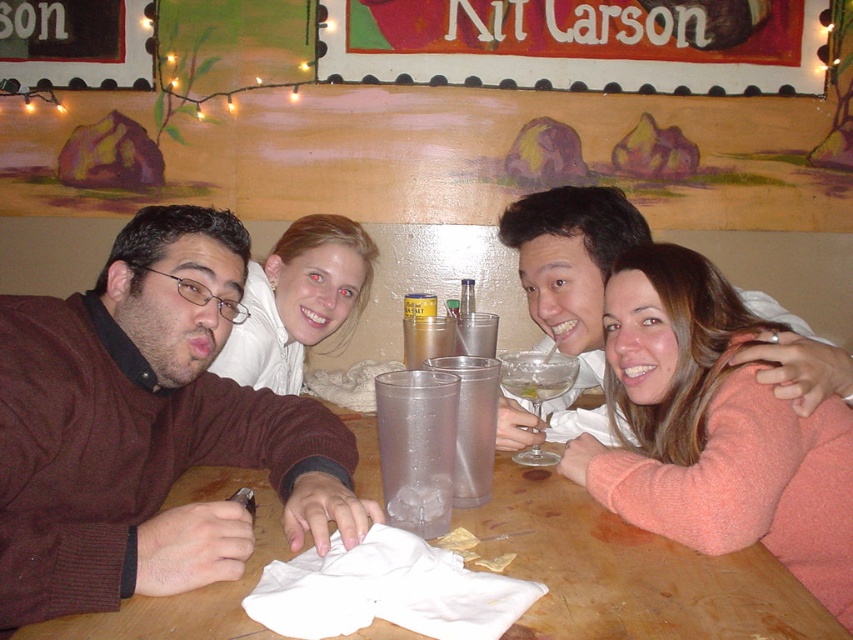
You are a photographer taking a group photo of the people at the table. You need to ensure that the pink sweater at center and the smooth white blouse at upper center are both clearly visible in the photo. Given their distance apart, can you fit both into the frame without moving either subject?

The pink sweater at center is 25.96 inches from the smooth white blouse at upper center. Since 25.96 inches is a relatively short distance, it is feasible to capture both in the same frame without needing to move either subject.

You are a fashion designer observing the image. You need to decide which sweater would be more suitable for a winter collection. Based on the sizes of the brown sweater at left and the pink sweater at center, which one is larger?

The brown sweater at left is bigger than the pink sweater at center, so it would be more suitable for a winter collection as larger sweaters typically provide more warmth.

You are a photographer setting up a shoot at this table. You need to place a small prop between the pink sweater at center and the smooth white blouse at upper center. Considering their sizes, which object should the prop be placed closer to?

The pink sweater at center is bigger than the smooth white blouse at upper center, so the prop should be placed closer to the pink sweater at center to maintain balance in the composition.